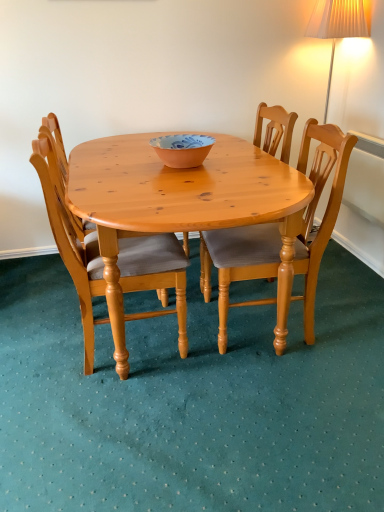
The width and height of the screenshot is (384, 512). In order to click on vacant point to the right of light brown wooden chair at center, positioned as the 3th chair in left-to-right order in this screenshot , I will do `click(348, 320)`.